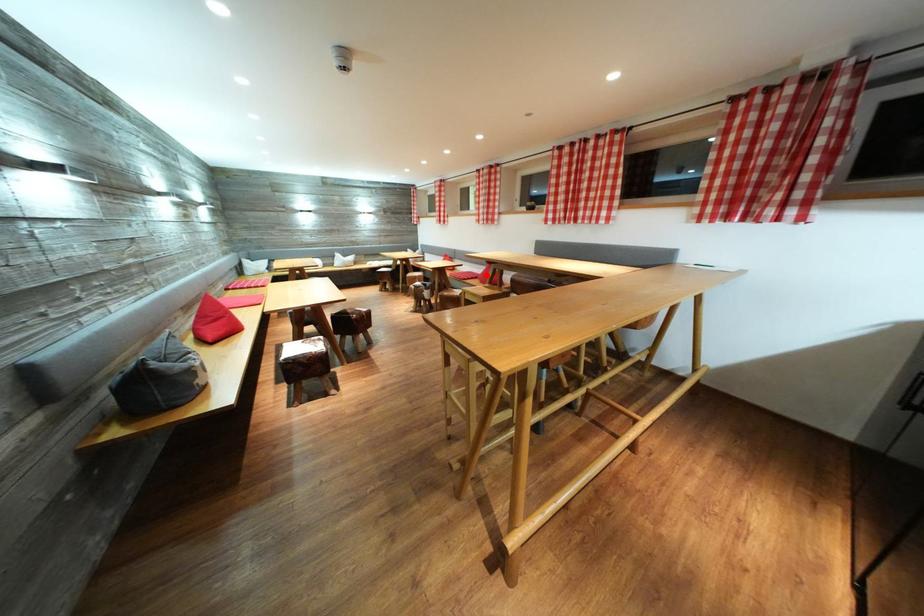
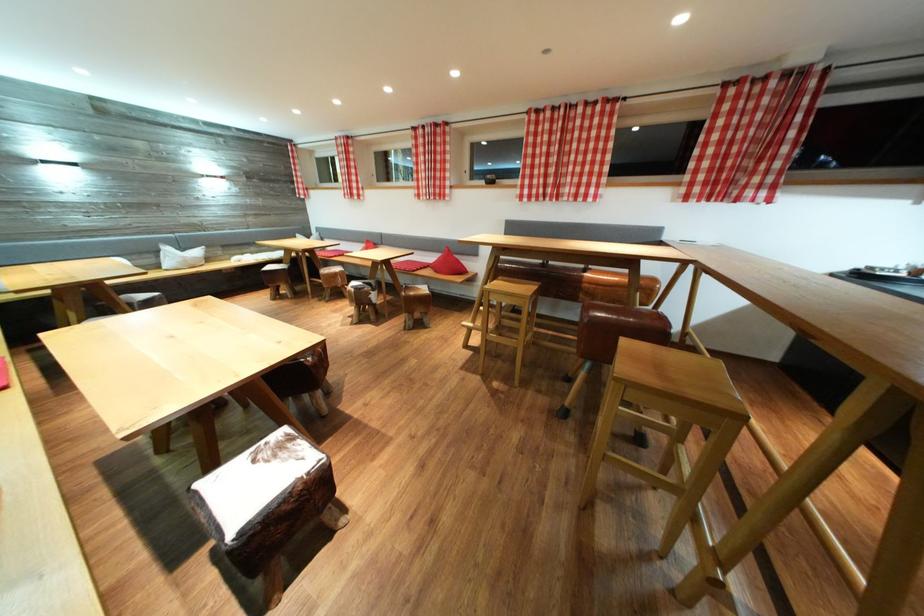
Where in the second image is the point corresponding to the highlighted location from the first image?

(438, 262)